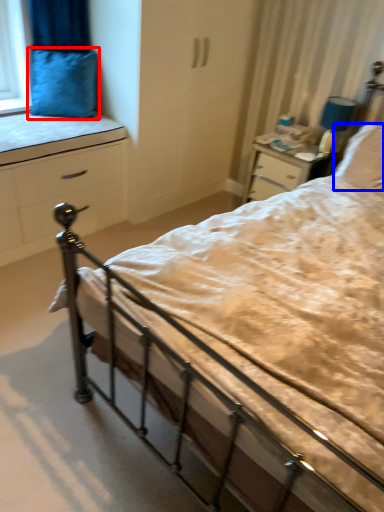
Question: Which object appears closest to the camera in this image, pillow (highlighted by a red box) or pillow (highlighted by a blue box)?

Choices:
 (A) pillow
 (B) pillow

Answer: (B)